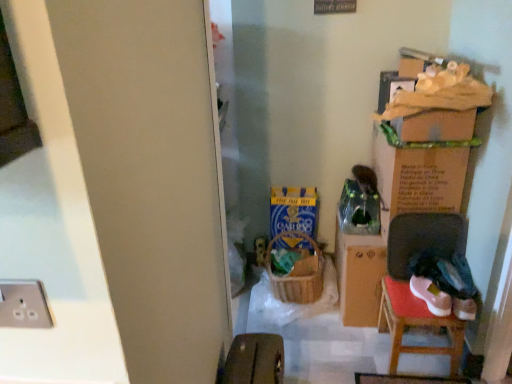
At what (x,y) coordinates should I click in order to perform the action: click on vacant space to the left of pink suede shoes at lower right. Please return your answer as a coordinate pair (x, y). The width and height of the screenshot is (512, 384). Looking at the image, I should click on (406, 298).